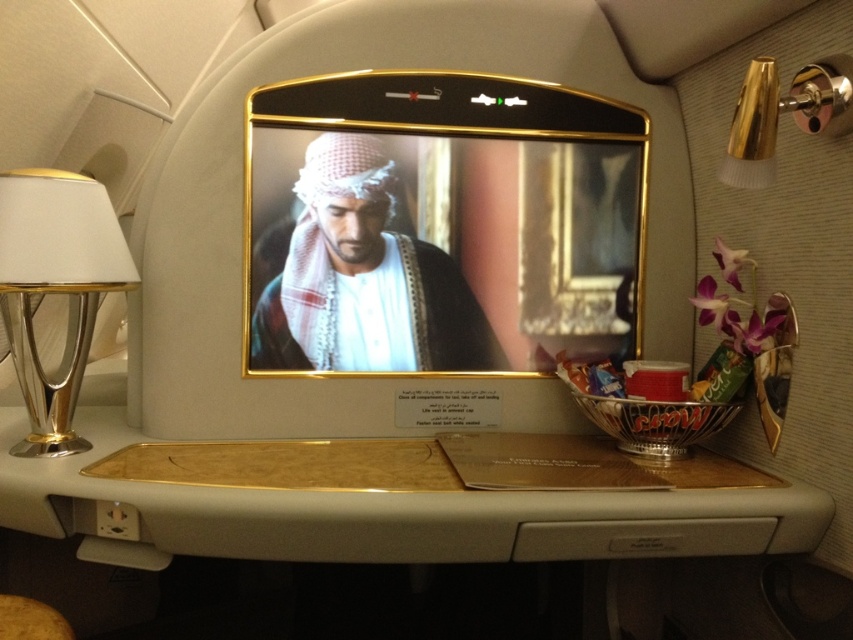
You are a passenger seated in the first class cabin of an Emirates flight. You want to reach the snacks on the tray table. The tray table is positioned at point [143,492]. If your arm can extend 3 feet, can you reach the snacks?

The distance between point [143,492] and the camera is 3.30 feet. Since your arm can only extend 3 feet, you cannot reach the snacks.

You are a flight attendant preparing to adjust the lighting in the cabin. You need to locate the larger lamp to set the ambiance. Which lamp should you choose between the metallic silver lamp at left and the gold metallic lamp at upper right?

The metallic silver lamp at left is larger in size than the gold metallic lamp at upper right, so you should choose the metallic silver lamp at left to set the ambiance.

You are a flight attendant checking the in flight entertainment system. You notice the gold wood tray at center and the matte white headscarf at center. Which object is shorter in height?

The gold wood tray at center is shorter in height than the matte white headscarf at center.